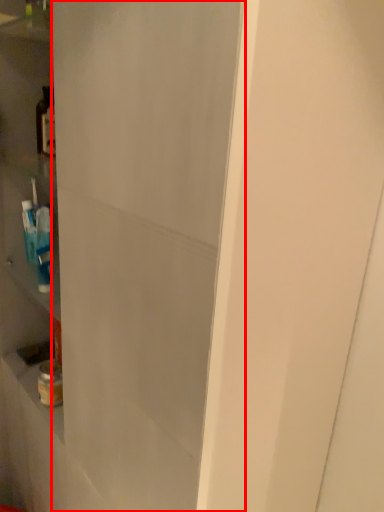
Question: From the image's perspective, what is the correct spatial positioning of glass door (annotated by the red box) in reference to bottle?

Choices:
 (A) below
 (B) above

Answer: (A)